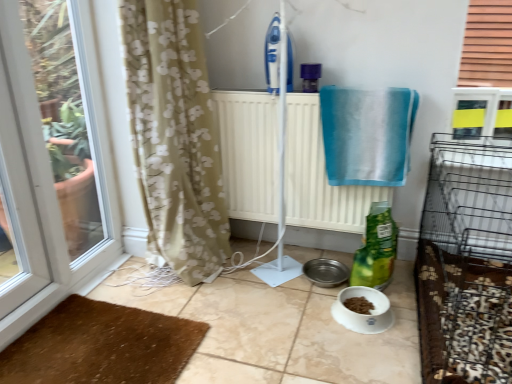
At what (x,y) coordinates should I click in order to perform the action: click on free space underneath brown textured mat at lower left (from a real-world perspective). Please return your answer as a coordinate pair (x, y). This screenshot has height=384, width=512. Looking at the image, I should click on (114, 352).